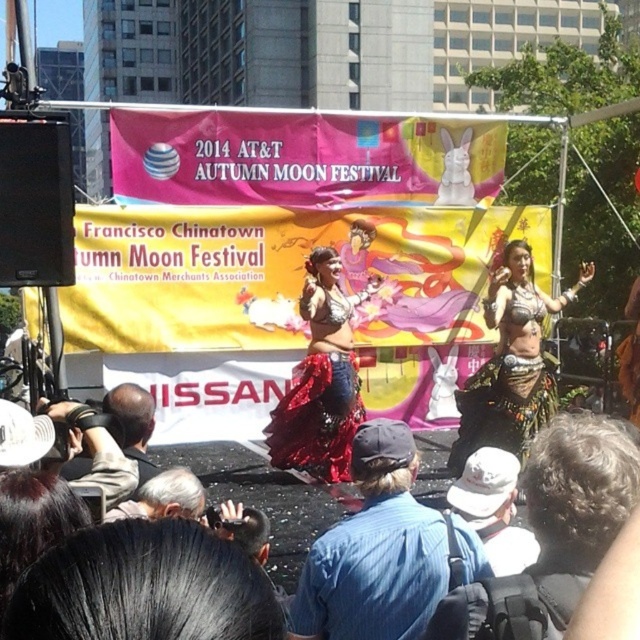
Question: In this image, where is denim jacket at lower right located relative to khaki cotton shirt at lower left?

Choices:
 (A) below
 (B) above

Answer: (A)

Question: Can you confirm if shiny sequined skirt at center is positioned to the left of dark gray fabric camera at lower left?

Choices:
 (A) no
 (B) yes

Answer: (A)

Question: Which object is the closest to the denim jacket at lower right?

Choices:
 (A) khaki cotton shirt at lower left
 (B) blue denim shirt at center

Answer: (B)

Question: Which of the following is the farthest from the observer?

Choices:
 (A) denim jacket at lower right
 (B) shiny red fabric at center
 (C) blue denim shirt at center
 (D) shiny sequined skirt at center

Answer: (B)

Question: Where is blue denim shirt at center located in relation to dark gray fabric camera at lower left in the image?

Choices:
 (A) left
 (B) right

Answer: (B)

Question: Based on their relative distances, which object is farther from the shiny red fabric at center?

Choices:
 (A) denim jacket at lower right
 (B) white cotton hat at center

Answer: (A)